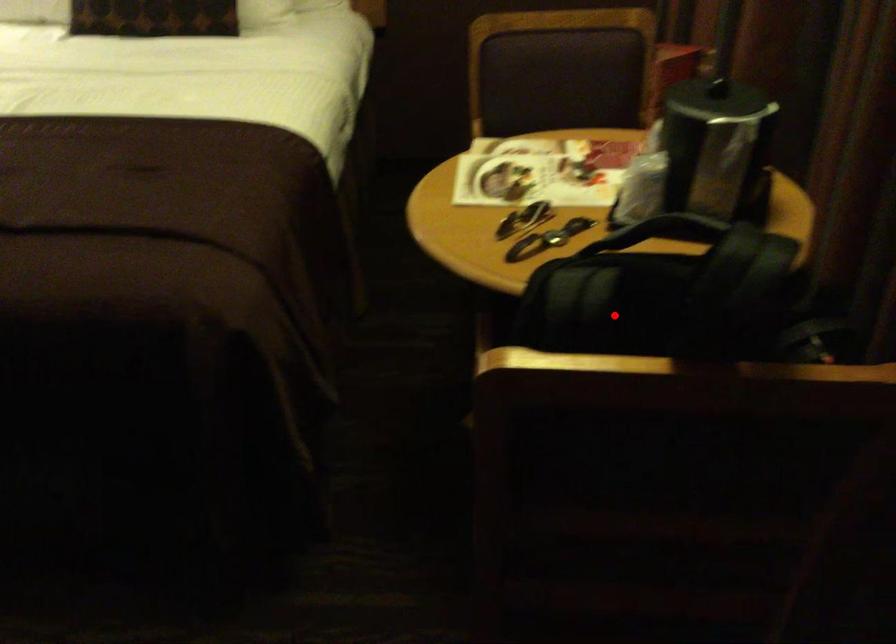
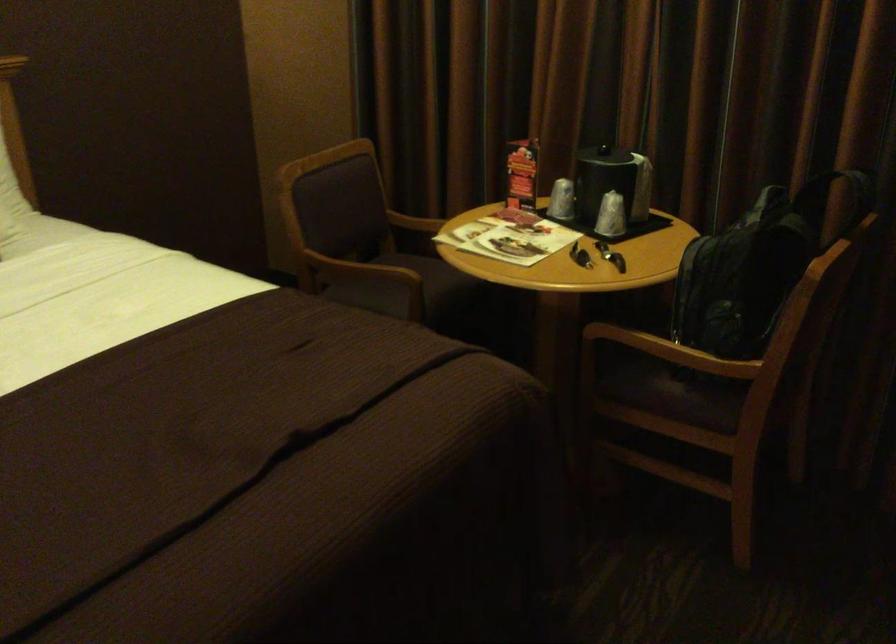
In the second image, find the point that corresponds to the highlighted location in the first image.

(757, 259)